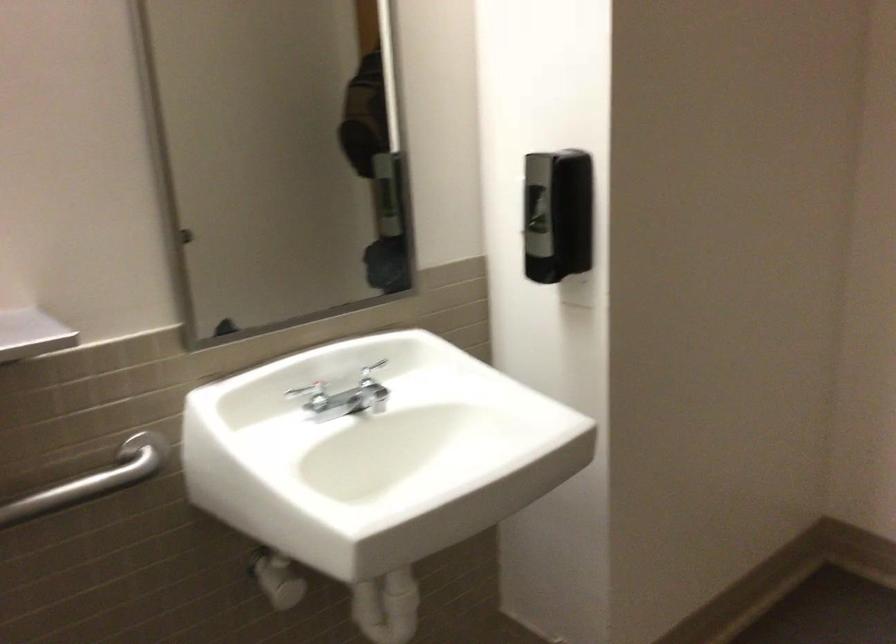
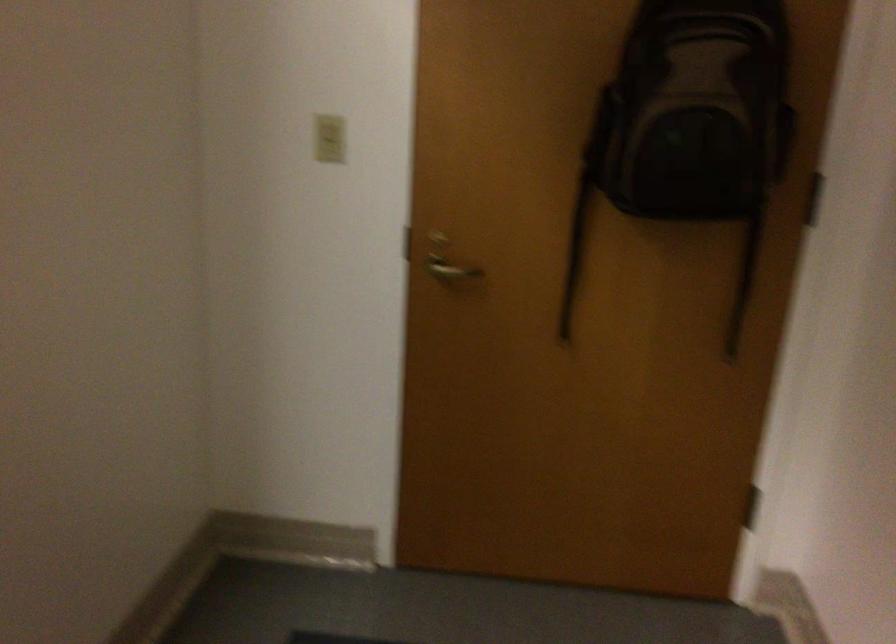
Question: The camera is either moving clockwise (left) or counter-clockwise (right) around the object. The first image is from the beginning of the video and the second image is from the end. Is the camera moving left or right when shooting the video?

Choices:
 (A) Left
 (B) Right

Answer: (A)